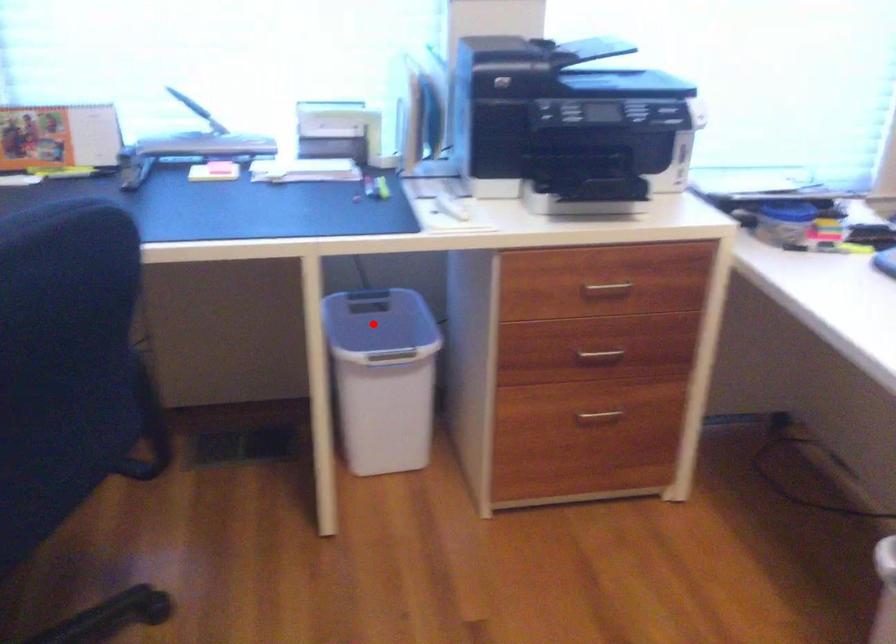
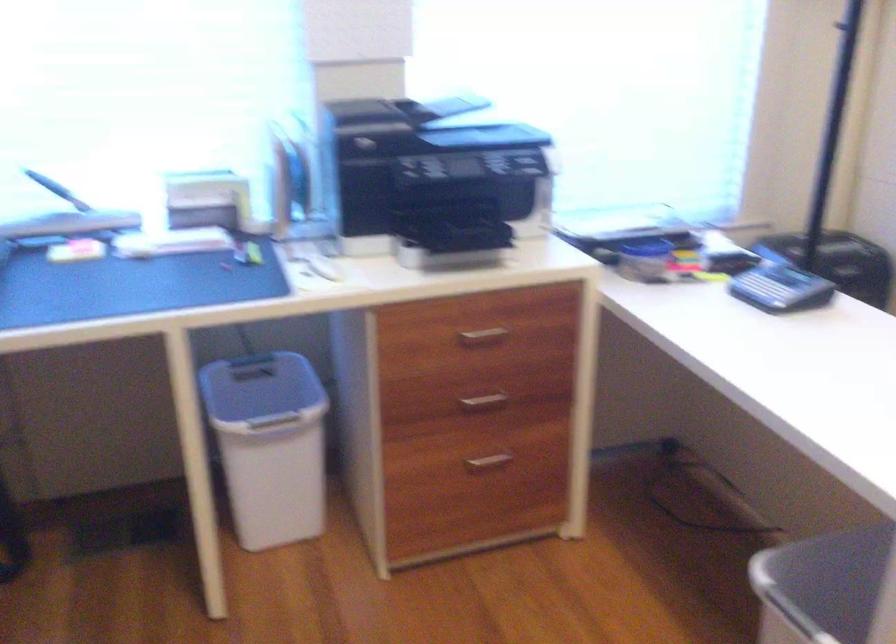
Find the pixel in the second image that matches the highlighted location in the first image.

(261, 390)